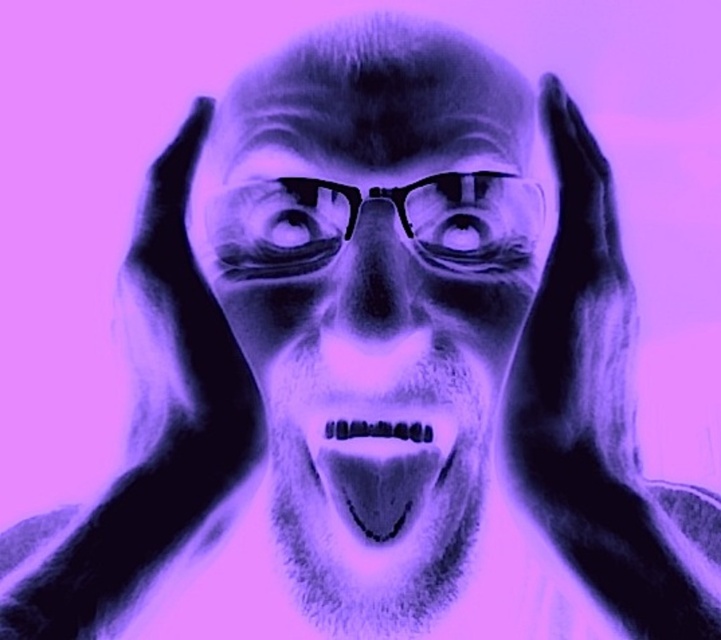
Question: Where is translucent purple face at center located in relation to translucent purple mouth at center in the image?

Choices:
 (A) below
 (B) above

Answer: (B)

Question: Which of the following is the farthest from the observer?

Choices:
 (A) translucent purple face at center
 (B) translucent purple mouth at center

Answer: (B)

Question: Among these points, which one is nearest to the camera?

Choices:
 (A) coord(311,308)
 (B) coord(335,467)

Answer: (B)

Question: Does translucent purple face at center have a smaller size compared to translucent purple mouth at center?

Choices:
 (A) yes
 (B) no

Answer: (B)

Question: Can you confirm if translucent purple face at center is smaller than translucent purple mouth at center?

Choices:
 (A) no
 (B) yes

Answer: (A)